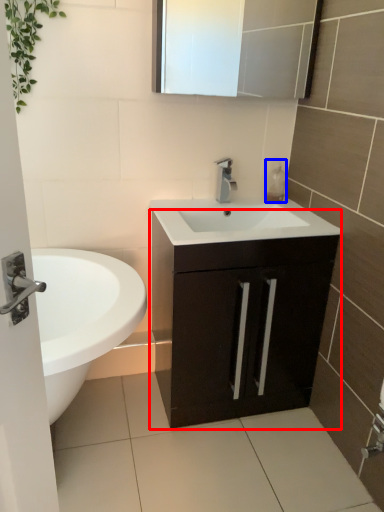
Question: Among these objects, which one is nearest to the camera, bathroom cabinet (highlighted by a red box) or soap dispenser (highlighted by a blue box)?

Choices:
 (A) bathroom cabinet
 (B) soap dispenser

Answer: (A)